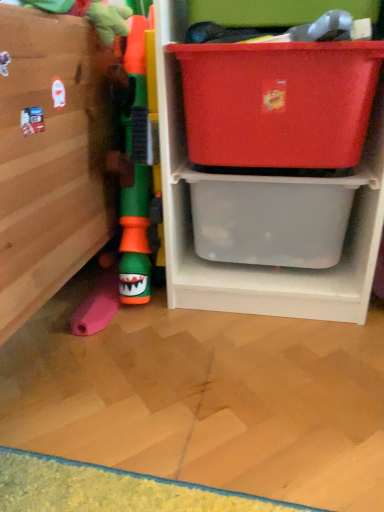
Image resolution: width=384 pixels, height=512 pixels. What do you see at coordinates (270, 220) in the screenshot? I see `transparent plastic storage box at lower right, which is the 2th storage box in top-to-bottom order` at bounding box center [270, 220].

Describe the element at coordinates (278, 102) in the screenshot. This screenshot has width=384, height=512. I see `matte plastic storage box at upper right, placed as the first storage box when sorted from top to bottom` at that location.

Image resolution: width=384 pixels, height=512 pixels. I want to click on transparent plastic storage box at lower right, the 1th storage box positioned from the bottom, so click(x=270, y=220).

Is transparent plastic storage box at lower right, the 1th storage box positioned from the bottom, turned away from green rubber toy at left?

No.

Does point (346, 221) come in front of point (133, 119)?

That is False.

From a real-world perspective, who is located lower, transparent plastic storage box at lower right, the 1th storage box positioned from the bottom, or green rubber toy at left?

From a 3D spatial view, transparent plastic storage box at lower right, the 1th storage box positioned from the bottom, is below.

How far apart are transparent plastic storage box at lower right, which is the 2th storage box in top-to-bottom order, and green rubber toy at left?

transparent plastic storage box at lower right, which is the 2th storage box in top-to-bottom order, and green rubber toy at left are 10.66 inches apart.

Does point (264, 128) lie behind point (329, 280)?

No.

In the scene shown: From a real-world perspective, who is located higher, matte plastic storage box at upper right, the 2th storage box in the bottom-to-top sequence, or translucent plastic storage at center?

matte plastic storage box at upper right, the 2th storage box in the bottom-to-top sequence, from a real-world perspective.

Is matte plastic storage box at upper right, placed as the first storage box when sorted from top to bottom, looking in the opposite direction of translucent plastic storage at center?

Yes, translucent plastic storage at center is at the back of matte plastic storage box at upper right, placed as the first storage box when sorted from top to bottom.

Which object is thinner, matte plastic storage box at upper right, the 2th storage box in the bottom-to-top sequence, or translucent plastic storage at center?

matte plastic storage box at upper right, the 2th storage box in the bottom-to-top sequence, is thinner.

Is green rubber toy at left at the left side of transparent plastic storage box at lower right, the 1th storage box positioned from the bottom?

Indeed, green rubber toy at left is positioned on the left side of transparent plastic storage box at lower right, the 1th storage box positioned from the bottom.

From the image's perspective, is green rubber toy at left below transparent plastic storage box at lower right, which is the 2th storage box in top-to-bottom order?

No.

Is green rubber toy at left directly adjacent to transparent plastic storage box at lower right, the 1th storage box positioned from the bottom?

green rubber toy at left and transparent plastic storage box at lower right, the 1th storage box positioned from the bottom, are not in contact.

Which object is more forward, green rubber toy at left or transparent plastic storage box at lower right, which is the 2th storage box in top-to-bottom order?

green rubber toy at left is in front.

In the scene shown: Is translucent plastic storage at center not inside green rubber toy at left?

That's correct, translucent plastic storage at center is outside of green rubber toy at left.

Can you confirm if translucent plastic storage at center is taller than green rubber toy at left?

Yes.

In the scene shown: Is translucent plastic storage at center smaller than green rubber toy at left?

No.

From the image's perspective, which is below, translucent plastic storage at center or green rubber toy at left?

green rubber toy at left, from the image's perspective.

From a real-world perspective, who is located lower, green rubber toy at left or matte plastic storage box at upper right, placed as the first storage box when sorted from top to bottom?

green rubber toy at left, from a real-world perspective.

Could you tell me if green rubber toy at left is turned towards matte plastic storage box at upper right, the 2th storage box in the bottom-to-top sequence?

No, green rubber toy at left does not turn towards matte plastic storage box at upper right, the 2th storage box in the bottom-to-top sequence.

Locate an element on the screen. storage box positioned vertically above the green rubber toy at left (from a real-world perspective) is located at coordinates (278, 102).

In the scene shown: Is green rubber toy at left positioned beyond the bounds of matte plastic storage box at upper right, the 2th storage box in the bottom-to-top sequence?

green rubber toy at left lies outside matte plastic storage box at upper right, the 2th storage box in the bottom-to-top sequence,'s area.

Could you measure the distance between matte plastic storage box at upper right, the 2th storage box in the bottom-to-top sequence, and transparent plastic storage box at lower right, the 1th storage box positioned from the bottom?

matte plastic storage box at upper right, the 2th storage box in the bottom-to-top sequence, and transparent plastic storage box at lower right, the 1th storage box positioned from the bottom, are 6.41 inches apart.

Consider the image. Are matte plastic storage box at upper right, placed as the first storage box when sorted from top to bottom, and transparent plastic storage box at lower right, which is the 2th storage box in top-to-bottom order, located far from each other?

No, matte plastic storage box at upper right, placed as the first storage box when sorted from top to bottom, is not far from transparent plastic storage box at lower right, which is the 2th storage box in top-to-bottom order.

From a real-world perspective, which is physically above, matte plastic storage box at upper right, placed as the first storage box when sorted from top to bottom, or transparent plastic storage box at lower right, which is the 2th storage box in top-to-bottom order?

In real-world perspective, matte plastic storage box at upper right, placed as the first storage box when sorted from top to bottom, is above.

Considering the positions of objects matte plastic storage box at upper right, placed as the first storage box when sorted from top to bottom, and transparent plastic storage box at lower right, the 1th storage box positioned from the bottom, in the image provided, who is behind, matte plastic storage box at upper right, placed as the first storage box when sorted from top to bottom, or transparent plastic storage box at lower right, the 1th storage box positioned from the bottom,?

transparent plastic storage box at lower right, the 1th storage box positioned from the bottom, is behind.

Identify the location of storage box in front of the transparent plastic storage box at lower right, the 1th storage box positioned from the bottom. (278, 102).

Looking at this image, which is more to the left, transparent plastic storage box at lower right, the 1th storage box positioned from the bottom, or matte plastic storage box at upper right, the 2th storage box in the bottom-to-top sequence?

Positioned to the left is matte plastic storage box at upper right, the 2th storage box in the bottom-to-top sequence.

Considering the relative sizes of transparent plastic storage box at lower right, the 1th storage box positioned from the bottom, and matte plastic storage box at upper right, the 2th storage box in the bottom-to-top sequence, in the image provided, is transparent plastic storage box at lower right, the 1th storage box positioned from the bottom, taller than matte plastic storage box at upper right, the 2th storage box in the bottom-to-top sequence,?

Incorrect, the height of transparent plastic storage box at lower right, the 1th storage box positioned from the bottom, is not larger of that of matte plastic storage box at upper right, the 2th storage box in the bottom-to-top sequence.

In the image, there is a green rubber toy at left. Where is `storage box below it (from the image's perspective)`? The image size is (384, 512). storage box below it (from the image's perspective) is located at coordinates (270, 220).

You are a GUI agent. You are given a task and a screenshot of the screen. Output one action in this format:
    pyautogui.click(x=<x>, y=<y>)
    Task: Click on the storage box above the translucent plastic storage at center (from a real-world perspective)
    This screenshot has width=384, height=512.
    Given the screenshot: What is the action you would take?
    pyautogui.click(x=278, y=102)

From the picture: When comparing their distances from transparent plastic storage box at lower right, the 1th storage box positioned from the bottom, does green rubber toy at left or matte plastic storage box at upper right, placed as the first storage box when sorted from top to bottom, seem closer?

matte plastic storage box at upper right, placed as the first storage box when sorted from top to bottom, is positioned closer to the anchor transparent plastic storage box at lower right, the 1th storage box positioned from the bottom.

Considering their positions, is green rubber toy at left positioned closer to translucent plastic storage at center than matte plastic storage box at upper right, placed as the first storage box when sorted from top to bottom?

matte plastic storage box at upper right, placed as the first storage box when sorted from top to bottom, is positioned closer to the anchor translucent plastic storage at center.

When comparing their distances from transparent plastic storage box at lower right, which is the 2th storage box in top-to-bottom order, does matte plastic storage box at upper right, placed as the first storage box when sorted from top to bottom, or translucent plastic storage at center seem further?

matte plastic storage box at upper right, placed as the first storage box when sorted from top to bottom, is further to transparent plastic storage box at lower right, which is the 2th storage box in top-to-bottom order.

Estimate the real-world distances between objects in this image. Which object is closer to matte plastic storage box at upper right, placed as the first storage box when sorted from top to bottom, transparent plastic storage box at lower right, the 1th storage box positioned from the bottom, or green rubber toy at left?

transparent plastic storage box at lower right, the 1th storage box positioned from the bottom, is closer to matte plastic storage box at upper right, placed as the first storage box when sorted from top to bottom.

Considering their positions, is translucent plastic storage at center positioned closer to transparent plastic storage box at lower right, which is the 2th storage box in top-to-bottom order, than green rubber toy at left?

Based on the image, translucent plastic storage at center appears to be nearer to transparent plastic storage box at lower right, which is the 2th storage box in top-to-bottom order.

Looking at the image, which one is located closer to translucent plastic storage at center, matte plastic storage box at upper right, placed as the first storage box when sorted from top to bottom, or green rubber toy at left?

matte plastic storage box at upper right, placed as the first storage box when sorted from top to bottom, lies closer to translucent plastic storage at center than the other object.

Based on their spatial positions, is transparent plastic storage box at lower right, the 1th storage box positioned from the bottom, or green rubber toy at left closer to translucent plastic storage at center?

transparent plastic storage box at lower right, the 1th storage box positioned from the bottom.

When comparing their distances from green rubber toy at left, does translucent plastic storage at center or transparent plastic storage box at lower right, which is the 2th storage box in top-to-bottom order, seem closer?

Based on the image, translucent plastic storage at center appears to be nearer to green rubber toy at left.

Locate an element on the screen. storage box located between green rubber toy at left and transparent plastic storage box at lower right, which is the 2th storage box in top-to-bottom order, in the left-right direction is located at coordinates (278, 102).

You are a GUI agent. You are given a task and a screenshot of the screen. Output one action in this format:
    pyautogui.click(x=<x>, y=<y>)
    Task: Click on the shelf that lies between matte plastic storage box at upper right, the 2th storage box in the bottom-to-top sequence, and transparent plastic storage box at lower right, the 1th storage box positioned from the bottom, from top to bottom
    
    Given the screenshot: What is the action you would take?
    pyautogui.click(x=250, y=266)